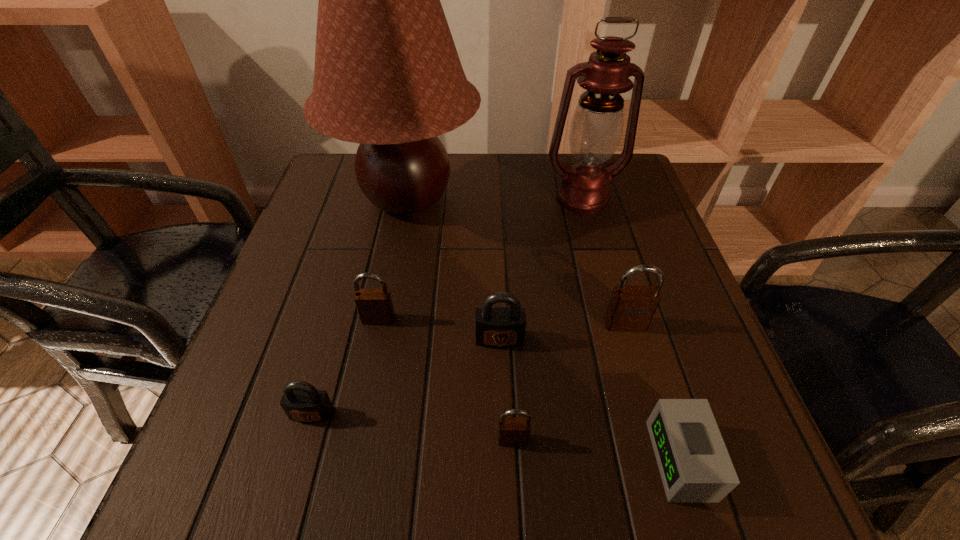
Locate an element on the screen. The image size is (960, 540). object that is the seventh closest to the leftmost brown padlock is located at coordinates (695, 467).

Locate which padlock is the fourth closest to the left gray padlock. Please provide its 2D coordinates. Your answer should be formatted as a tuple, i.e. [(x, y)], where the tuple contains the x and y coordinates of a point satisfying the conditions above.

[(631, 308)]

Identify which padlock is the second nearest to the nearest padlock. Please provide its 2D coordinates. Your answer should be formatted as a tuple, i.e. [(x, y)], where the tuple contains the x and y coordinates of a point satisfying the conditions above.

[(631, 308)]

What are the coordinates of `brown padlock that is the second closest to the smaller gray padlock` in the screenshot? It's located at (512, 431).

Where is `brown padlock that can be found as the third closest to the nearer gray padlock`? The image size is (960, 540). brown padlock that can be found as the third closest to the nearer gray padlock is located at coordinates (631, 308).